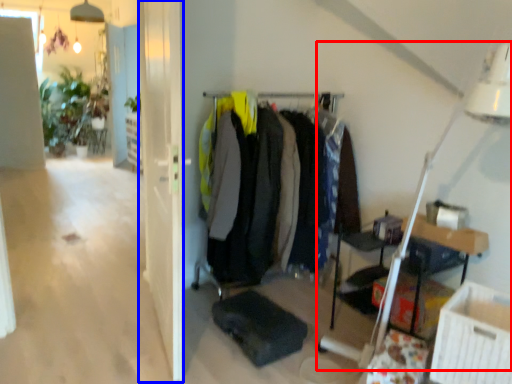
Question: Which object is closer to the camera taking this photo, table lamp (highlighted by a red box) or glass door (highlighted by a blue box)?

Choices:
 (A) table lamp
 (B) glass door

Answer: (A)